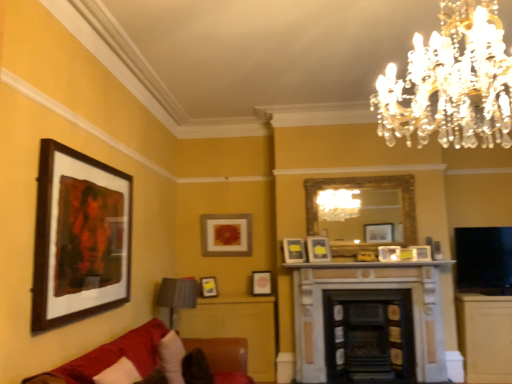
This screenshot has height=384, width=512. I want to click on stone fireplace at center, the 2th fireplace viewed from the right, so click(368, 289).

At what (x,y) coordinates should I click in order to perform the action: click on matte black picture frame at center, the second picture frame when ordered from right to left. Please return your answer as a coordinate pair (x, y). Image resolution: width=512 pixels, height=384 pixels. Looking at the image, I should click on (389, 253).

Where is `matte white picture frame at center-right, positioned as the eighth picture frame in left-to-right order`? The image size is (512, 384). matte white picture frame at center-right, positioned as the eighth picture frame in left-to-right order is located at coordinates (421, 253).

Locate an element on the screen. velvet red couch at lower left is located at coordinates (148, 361).

This screenshot has width=512, height=384. Describe the element at coordinates (148, 361) in the screenshot. I see `velvet red couch at lower left` at that location.

In order to face gold ornate mirror at center, should I rotate leftwards or rightwards?

Rotate right and turn 13.730 degrees.

The width and height of the screenshot is (512, 384). I want to click on gold ornate mirror at center, so click(x=365, y=187).

I want to click on wooden framed artwork at left, the first picture frame in the front-to-back sequence, so click(x=79, y=237).

Looking at this image, measure the distance between point (188,373) and camera.

Point (188,373) and camera are 3.31 meters apart from each other.

Find the location of a particular element. The height and width of the screenshot is (384, 512). stone fireplace at center, the first fireplace in the left-to-right sequence is located at coordinates (368, 289).

From the image's perspective, is clear crystal chandelier at upper center located above wooden framed artwork at left, the first picture frame in the front-to-back sequence?

Correct, clear crystal chandelier at upper center appears higher than wooden framed artwork at left, the first picture frame in the front-to-back sequence, in the image.

Is clear crystal chandelier at upper center shorter than wooden framed artwork at left, marked as the 8th picture frame in a right-to-left arrangement?

Yes.

Is clear crystal chandelier at upper center in front of or behind wooden framed artwork at left, the first picture frame in the front-to-back sequence, in the image?

Clearly, clear crystal chandelier at upper center is in front of wooden framed artwork at left, the first picture frame in the front-to-back sequence.

Between gold ornate mirror at center and stone fireplace at center, the first fireplace in the left-to-right sequence, which one is positioned in front?

stone fireplace at center, the first fireplace in the left-to-right sequence, is closer to the camera.

From the image's perspective, would you say gold ornate mirror at center is shown under stone fireplace at center, the first fireplace in the left-to-right sequence?

Incorrect, from the image's perspective, gold ornate mirror at center is higher than stone fireplace at center, the first fireplace in the left-to-right sequence.

Which of these two, gold ornate mirror at center or stone fireplace at center, the 2th fireplace viewed from the right, stands shorter?

Standing shorter between the two is gold ornate mirror at center.

From a real-world perspective, is gold ornate mirror at center over stone fireplace at center, the 2th fireplace viewed from the right?

Indeed, from a real-world perspective, gold ornate mirror at center stands above stone fireplace at center, the 2th fireplace viewed from the right.

Between matte white picture frame at center-right, placed as the 7th picture frame when sorted from back to front, and matte wooden picture frame at center, the second picture frame viewed from the back, which one appears on the left side from the viewer's perspective?

Positioned to the left is matte wooden picture frame at center, the second picture frame viewed from the back.

From a real-world perspective, is matte white picture frame at center-right, marked as the second picture frame in a front-to-back arrangement, above or below matte wooden picture frame at center, marked as the fifth picture frame in a right-to-left arrangement?

matte white picture frame at center-right, marked as the second picture frame in a front-to-back arrangement, is above matte wooden picture frame at center, marked as the fifth picture frame in a right-to-left arrangement.

Which of these two, matte white picture frame at center-right, which appears as the first picture frame when viewed from the right, or matte wooden picture frame at center, positioned as the fourth picture frame in left-to-right order, is bigger?

matte wooden picture frame at center, positioned as the fourth picture frame in left-to-right order, is bigger.

Is matte gold picture frame at center, the third picture frame viewed from the left, far from matte yellow picture frame at center, placed as the 3th picture frame when sorted from front to back?

No, matte gold picture frame at center, the third picture frame viewed from the left, is not far from matte yellow picture frame at center, placed as the 3th picture frame when sorted from front to back.

Which is nearer, (238, 225) or (324, 242)?

The point (324, 242) is more forward.

Which is behind, matte gold picture frame at center, the third picture frame viewed from the left, or matte yellow picture frame at center, placed as the 3th picture frame when sorted from front to back?

matte gold picture frame at center, the third picture frame viewed from the left, is further away from the camera.

Considering the relative positions of matte gold picture frame at center, which appears as the 8th picture frame when viewed from the front, and matte yellow picture frame at center, placed as the 3th picture frame when sorted from front to back, in the image provided, is matte gold picture frame at center, which appears as the 8th picture frame when viewed from the front, to the right of matte yellow picture frame at center, placed as the 3th picture frame when sorted from front to back, from the viewer's perspective?

No.

Is there a large distance between matte wooden picture frame at center, marked as the fifth picture frame in a right-to-left arrangement, and matte white picture frame at center, acting as the fifth picture frame starting from the front?

No, matte wooden picture frame at center, marked as the fifth picture frame in a right-to-left arrangement, is not far away from matte white picture frame at center, acting as the fifth picture frame starting from the front.

Which of these two, matte wooden picture frame at center, marked as the fifth picture frame in a right-to-left arrangement, or matte white picture frame at center, which appears as the fourth picture frame when viewed from the back, stands taller?

With more height is matte white picture frame at center, which appears as the fourth picture frame when viewed from the back.

Consider the image. Which is more to the left, matte wooden picture frame at center, positioned as the fourth picture frame in left-to-right order, or matte white picture frame at center, which appears as the fourth picture frame when viewed from the back?

Positioned to the left is matte wooden picture frame at center, positioned as the fourth picture frame in left-to-right order.

Does point (257, 291) appear closer or farther from the camera than point (295, 253)?

Point (257, 291).

Is point (425, 256) closer to camera compared to point (401, 289)?

Yes.

Is matte white picture frame at center-right, which appears as the first picture frame when viewed from the right, thinner than stone fireplace at center, the first fireplace in the left-to-right sequence?

Correct, the width of matte white picture frame at center-right, which appears as the first picture frame when viewed from the right, is less than that of stone fireplace at center, the first fireplace in the left-to-right sequence.

From the image's perspective, which is above, matte white picture frame at center-right, positioned as the eighth picture frame in left-to-right order, or stone fireplace at center, the 2th fireplace viewed from the right?

matte white picture frame at center-right, positioned as the eighth picture frame in left-to-right order, appears higher in the image.

Which object is positioned more to the left, matte white picture frame at center-right, which appears as the first picture frame when viewed from the right, or stone fireplace at center, the 2th fireplace viewed from the right?

Positioned to the left is stone fireplace at center, the 2th fireplace viewed from the right.

Considering the sizes of objects velvet red couch at lower left and matte black picture frame at center, which is counted as the seventh picture frame, starting from the left, in the image provided, who is smaller, velvet red couch at lower left or matte black picture frame at center, which is counted as the seventh picture frame, starting from the left,?

With smaller size is matte black picture frame at center, which is counted as the seventh picture frame, starting from the left.

What's the angular difference between velvet red couch at lower left and matte black picture frame at center, which is counted as the seventh picture frame, starting from the left,'s facing directions?

There is a 98.4-degree angle between the facing directions of velvet red couch at lower left and matte black picture frame at center, which is counted as the seventh picture frame, starting from the left.

Which object is wider, velvet red couch at lower left or matte black picture frame at center, which ranks as the 5th picture frame in back-to-front order?

With larger width is velvet red couch at lower left.

Where is `chandelier that is in front of the wooden framed artwork at left, the first picture frame positioned from the left`? Image resolution: width=512 pixels, height=384 pixels. chandelier that is in front of the wooden framed artwork at left, the first picture frame positioned from the left is located at coordinates (452, 83).

At what (x,y) coordinates should I click in order to perform the action: click on mirror behind the stone fireplace at center, the first fireplace in the left-to-right sequence. Please return your answer as a coordinate pair (x, y). Image resolution: width=512 pixels, height=384 pixels. Looking at the image, I should click on (365, 187).

Which object lies nearer to the anchor point matte yellow picture frame at center, arranged as the third picture frame when viewed from the right, white marble fireplace at center or velvet red couch at lower left?

white marble fireplace at center.

Estimate the real-world distances between objects in this image. Which object is closer to stone fireplace at center, the first fireplace in the left-to-right sequence, matte wooden picture frame at center, the second picture frame viewed from the back, or matte yellow picture frame at center, placed as the 3th picture frame when sorted from front to back?

The object closer to stone fireplace at center, the first fireplace in the left-to-right sequence, is matte yellow picture frame at center, placed as the 3th picture frame when sorted from front to back.

Based on their spatial positions, is brown fuzzy pillow at lower left, the second pillow positioned from the left, or velvet red couch at lower left further from gold ornate mirror at center?

The object further to gold ornate mirror at center is brown fuzzy pillow at lower left, the second pillow positioned from the left.

Looking at the image, which one is located further to wooden framed artwork at left, marked as the 8th picture frame in a right-to-left arrangement, white soft pillow at lower left, the second pillow from the right, or matte white picture frame at center, which appears as the fourth picture frame when viewed from the back?

matte white picture frame at center, which appears as the fourth picture frame when viewed from the back, is further to wooden framed artwork at left, marked as the 8th picture frame in a right-to-left arrangement.

Looking at the image, which one is located closer to clear crystal chandelier at upper center, matte black picture frame at center, which ranks as the 5th picture frame in back-to-front order, or white soft pillow at lower left, placed as the first pillow when sorted from left to right?

white soft pillow at lower left, placed as the first pillow when sorted from left to right, is positioned closer to the anchor clear crystal chandelier at upper center.

Based on their spatial positions, is matte wooden picture frame at center, positioned as the fourth picture frame in left-to-right order, or white marble fireplace at center closer to velvet red couch at lower left?

Among the two, matte wooden picture frame at center, positioned as the fourth picture frame in left-to-right order, is located nearer to velvet red couch at lower left.

Considering their positions, is gold ornate mirror at center positioned closer to matte yellow picture frame at center, positioned as the sixth picture frame in back-to-front order, than matte yellow picture frame at center, which is counted as the 3th picture frame, starting from the back?

Among the two, gold ornate mirror at center is located nearer to matte yellow picture frame at center, positioned as the sixth picture frame in back-to-front order.

Which object lies further to the anchor point matte yellow picture frame at center, arranged as the third picture frame when viewed from the right, matte white picture frame at center-right, positioned as the eighth picture frame in left-to-right order, or clear crystal chandelier at upper center?

The object further to matte yellow picture frame at center, arranged as the third picture frame when viewed from the right, is clear crystal chandelier at upper center.

This screenshot has height=384, width=512. I want to click on fireplace between gold ornate mirror at center and dark brown wood fireplace at center, acting as the first fireplace starting from the right, from top to bottom, so click(368, 289).

I want to click on lamp between velvet red couch at lower left and matte gold picture frame at center, which appears as the 8th picture frame when viewed from the front, from front to back, so click(x=177, y=295).

The width and height of the screenshot is (512, 384). I want to click on mantle between matte gold picture frame at center, marked as the 1th picture frame in a back-to-front arrangement, and matte black picture frame at center, the second picture frame when ordered from right to left, so click(x=367, y=264).

Locate an element on the screen. fireplace between wooden framed artwork at left, the first picture frame positioned from the left, and dark brown wood fireplace at center, placed as the second fireplace when sorted from left to right, from left to right is located at coordinates (368, 289).